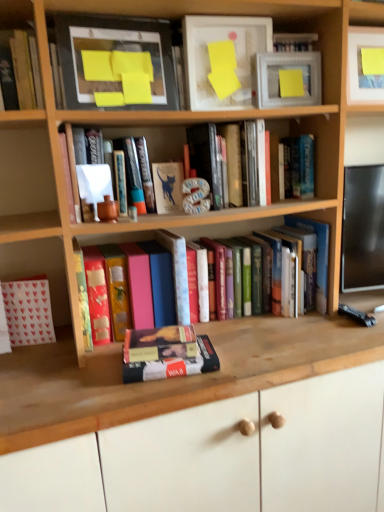
This screenshot has width=384, height=512. I want to click on vacant area situated to the left side of hardcover book at center, which is the 4th book in left-to-right order, so click(88, 381).